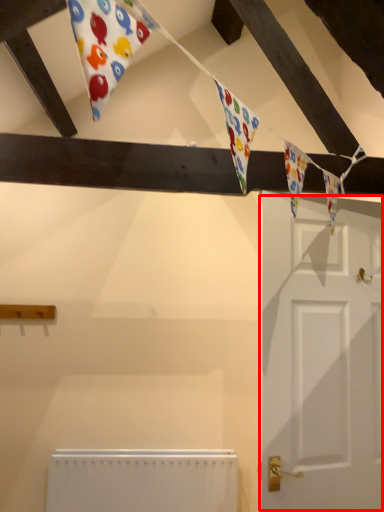
Question: From the image's perspective, what is the correct spatial positioning of door (annotated by the red box) in reference to radiator?

Choices:
 (A) above
 (B) below

Answer: (A)